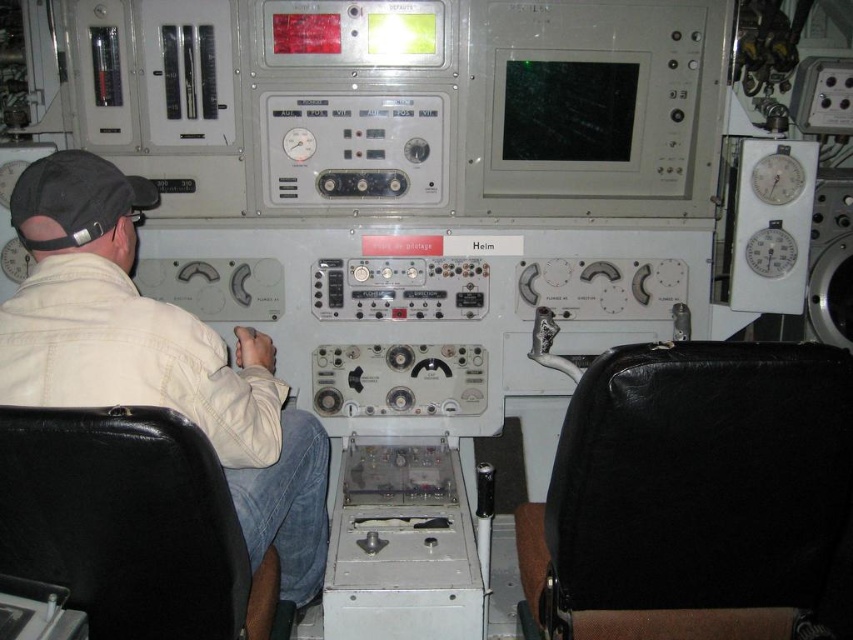
Is point (799, 385) farther from camera compared to point (302, 484)?

No, it is in front of (302, 484).

Who is shorter, black leather chair at right or white leather jacket at left?

black leather chair at right

Locate an element on the screen. black leather chair at right is located at coordinates (699, 497).

Is white leather jacket at left taller than black fabric baseball cap at left?

→ Indeed, white leather jacket at left has a greater height compared to black fabric baseball cap at left.

Image resolution: width=853 pixels, height=640 pixels. Identify the location of white leather jacket at left. (160, 364).

Which is above, white leather jacket at left or black leather chair at lower left?

white leather jacket at left is above.

From the picture: Between white leather jacket at left and black leather chair at lower left, which one is positioned lower?

black leather chair at lower left is below.

Who is more forward, [234,483] or [173,426]?

Positioned in front is point [173,426].

This screenshot has width=853, height=640. Find the location of `white leather jacket at left`. white leather jacket at left is located at coordinates coord(160,364).